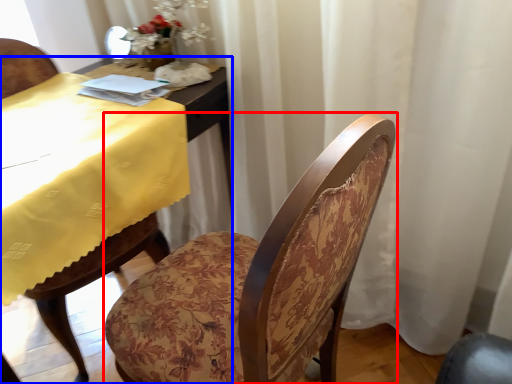
Question: Among these objects, which one is nearest to the camera, chair (highlighted by a red box) or table (highlighted by a blue box)?

Choices:
 (A) chair
 (B) table

Answer: (A)